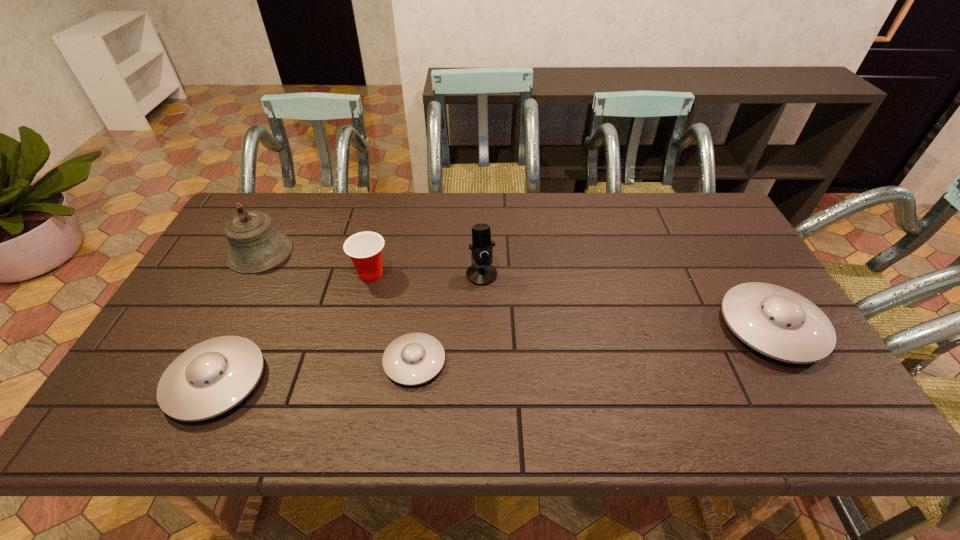
At what (x,y) coordinates should I click in order to perform the action: click on free point between the rightmost object and the second object from right to left. Please return your answer as a coordinate pair (x, y). This screenshot has height=540, width=960. Looking at the image, I should click on (627, 301).

Find the location of a particular element. The height and width of the screenshot is (540, 960). empty space between the third object from left to right and the fifth object from left to right is located at coordinates (426, 274).

At what (x,y) coordinates should I click in order to perform the action: click on empty space between the cup and the second shortest object. Please return your answer as a coordinate pair (x, y). This screenshot has height=540, width=960. Looking at the image, I should click on (294, 328).

Find the location of a particular element. The image size is (960, 540). free space between the rightmost saucer and the microphone is located at coordinates (627, 301).

Locate an element on the screen. vacant space in between the rightmost saucer and the shortest saucer is located at coordinates (593, 345).

Image resolution: width=960 pixels, height=540 pixels. I want to click on free space between the bell and the rightmost object, so click(x=516, y=289).

Where is `object that is the fifth closest one to the second object from right to left`? The image size is (960, 540). object that is the fifth closest one to the second object from right to left is located at coordinates (777, 322).

You are a GUI agent. You are given a task and a screenshot of the screen. Output one action in this format:
    pyautogui.click(x=<x>, y=<y>)
    Task: Click on the object that is the fourth nearest to the bell
    
    Given the screenshot: What is the action you would take?
    pyautogui.click(x=481, y=272)

You are a GUI agent. You are given a task and a screenshot of the screen. Output one action in this format:
    pyautogui.click(x=<x>, y=<y>)
    Task: Click on the saucer that stands as the third closest to the bell
    
    Given the screenshot: What is the action you would take?
    pyautogui.click(x=777, y=322)

This screenshot has height=540, width=960. I want to click on saucer that is the closest one to the rightmost object, so (412, 359).